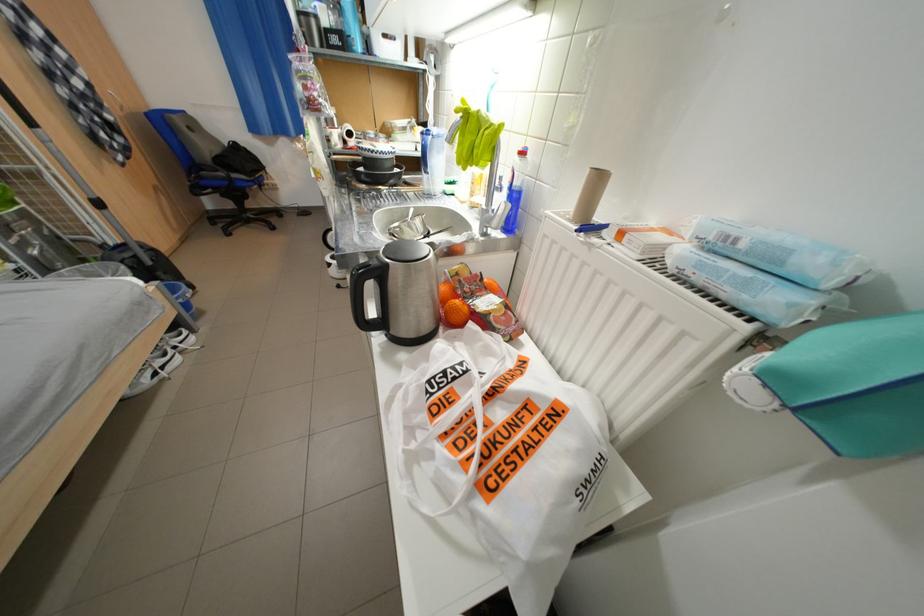
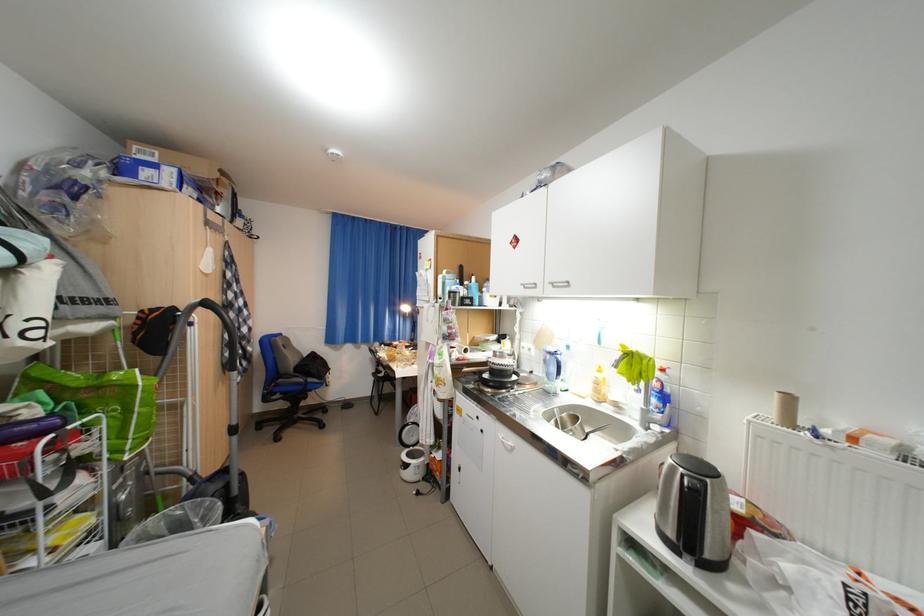
Find the pixel in the second image that matches point (460, 140) in the first image.

(627, 368)